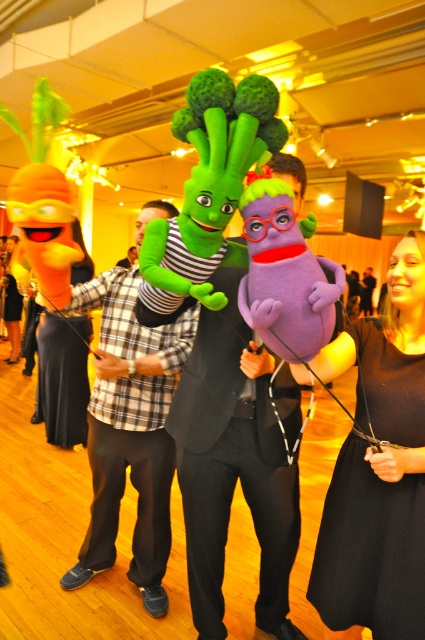
Question: Is black dress at center below matte black suit at center?

Choices:
 (A) yes
 (B) no

Answer: (A)

Question: Considering the relative positions of black satin dress at lower right and green plush toy at center in the image provided, where is black satin dress at lower right located with respect to green plush toy at center?

Choices:
 (A) right
 (B) left

Answer: (A)

Question: Which object is positioned closest to the black satin dress at lower right?

Choices:
 (A) plush green costume at center
 (B) green plush toy at center
 (C) matte black suit at center

Answer: (B)

Question: Is black satin dress at lower right to the right of matte black suit at center from the viewer's perspective?

Choices:
 (A) yes
 (B) no

Answer: (B)

Question: Estimate the real-world distances between objects in this image. Which object is closer to the matte black suit at center?

Choices:
 (A) black satin dress at lower right
 (B) green plush toy at center
 (C) black dress at center

Answer: (C)

Question: Which of the following is the farthest from the observer?

Choices:
 (A) (149, 445)
 (B) (11, 328)
 (C) (362, 289)
 (D) (411, 417)

Answer: (C)